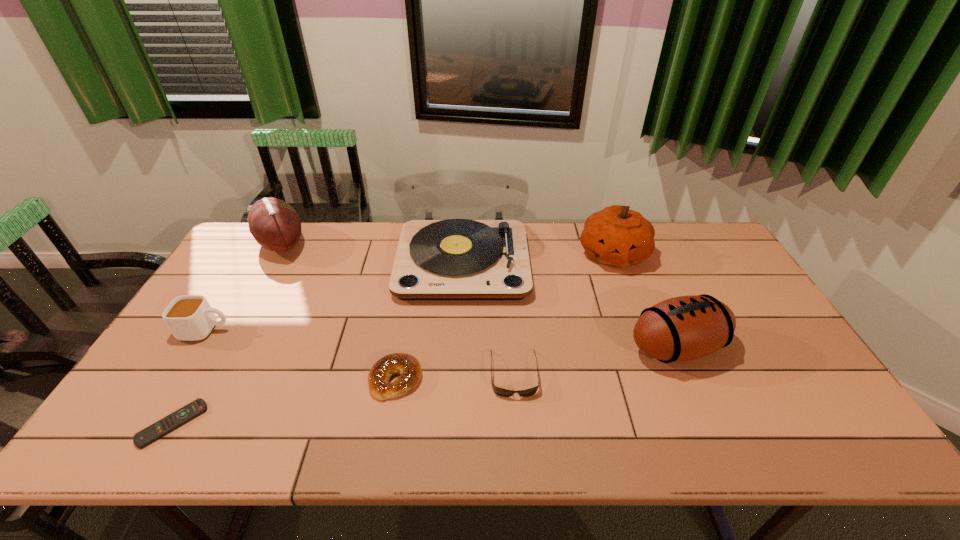
Identify the location of the fifth closest object to the pumpkin. Image resolution: width=960 pixels, height=540 pixels. (275, 225).

Where is `object that is the sixth closest one to the sunglasses`? object that is the sixth closest one to the sunglasses is located at coordinates tap(275, 225).

Where is `free space that satisfies the following two spatial constraints: 1. on the side with the handle of the cup; 2. on the left side of the bagel`? Image resolution: width=960 pixels, height=540 pixels. free space that satisfies the following two spatial constraints: 1. on the side with the handle of the cup; 2. on the left side of the bagel is located at coordinates (176, 380).

You are a GUI agent. You are given a task and a screenshot of the screen. Output one action in this format:
    pyautogui.click(x=<x>, y=<y>)
    Task: Click on the free space that satisfies the following two spatial constraints: 1. on the back side of the shortest object; 2. on the right side of the nearer football (American)
    This screenshot has height=540, width=960.
    Given the screenshot: What is the action you would take?
    pyautogui.click(x=217, y=347)